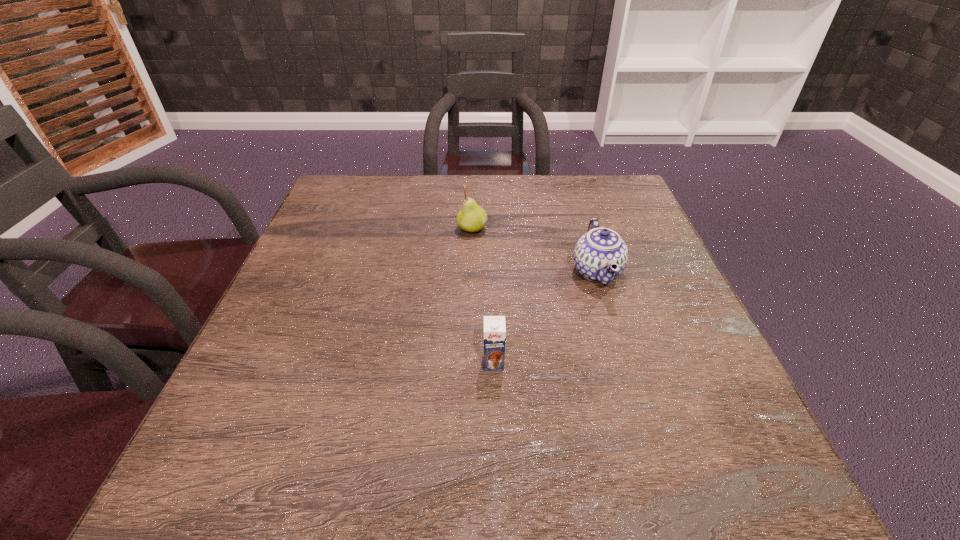
You are a GUI agent. You are given a task and a screenshot of the screen. Output one action in this format:
    pyautogui.click(x=<x>, y=<y>)
    Task: Click on the vacant space that is in between the chocolate milk and the rightmost object
    The height and width of the screenshot is (540, 960).
    Given the screenshot: What is the action you would take?
    pyautogui.click(x=545, y=318)

Locate an element on the screen. The width and height of the screenshot is (960, 540). empty space between the chocolate milk and the farthest object is located at coordinates (483, 296).

Where is `free area in between the rightmost object and the farthest object`? free area in between the rightmost object and the farthest object is located at coordinates (535, 250).

At what (x,y) coordinates should I click in order to perform the action: click on empty space that is in between the pear and the second nearest object. Please return your answer as a coordinate pair (x, y). The width and height of the screenshot is (960, 540). Looking at the image, I should click on (535, 250).

Find the location of a particular element. the second closest object to the chocolate milk is located at coordinates (472, 218).

This screenshot has height=540, width=960. I want to click on object that can be found as the closest to the chocolate milk, so click(x=600, y=255).

You are a GUI agent. You are given a task and a screenshot of the screen. Output one action in this format:
    pyautogui.click(x=<x>, y=<y>)
    Task: Click on the vacant region that satisfies the following two spatial constraints: 1. at the spout of the rightmost object; 2. on the front label of the nearest object
    The width and height of the screenshot is (960, 540).
    Given the screenshot: What is the action you would take?
    pyautogui.click(x=625, y=363)

Identify the location of free space that satisfies the following two spatial constraints: 1. at the spout of the rightmost object; 2. on the front label of the nearest object. (625, 363).

This screenshot has width=960, height=540. I want to click on free space that satisfies the following two spatial constraints: 1. at the spout of the second nearest object; 2. on the front label of the chocolate milk, so click(625, 363).

Locate an element on the screen. The width and height of the screenshot is (960, 540). free spot that satisfies the following two spatial constraints: 1. at the spout of the rightmost object; 2. on the front label of the nearest object is located at coordinates (625, 363).